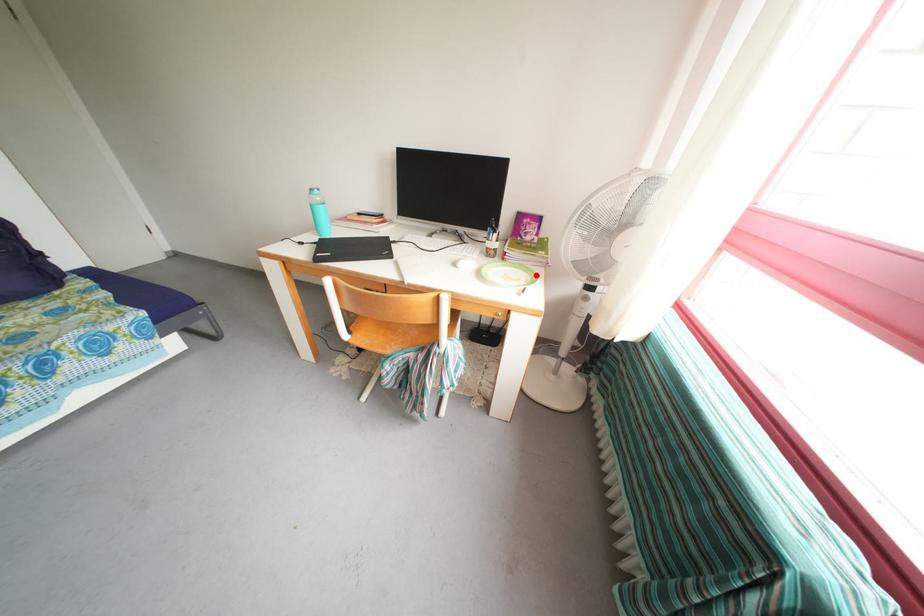
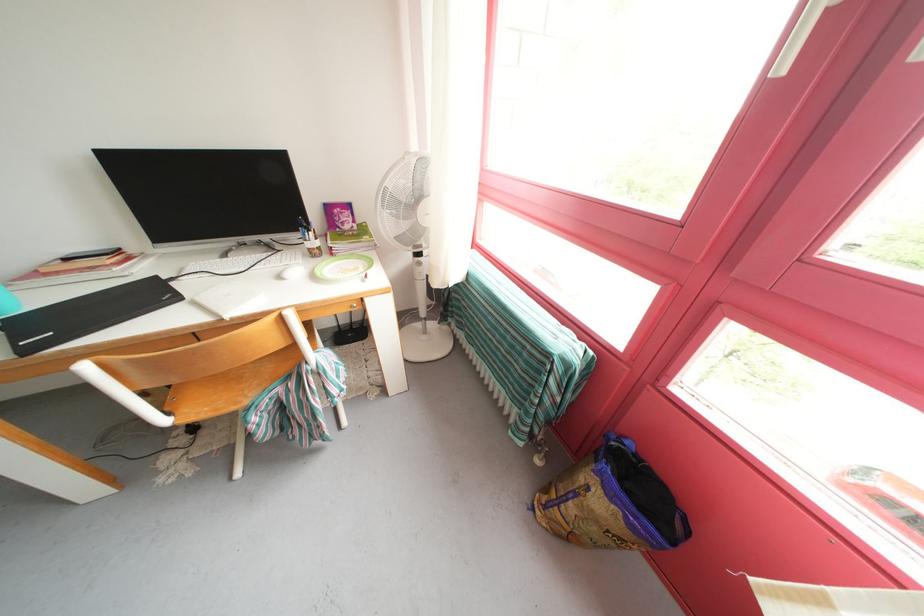
In the second image, find the point that corresponds to the highlighted location in the first image.

(369, 262)